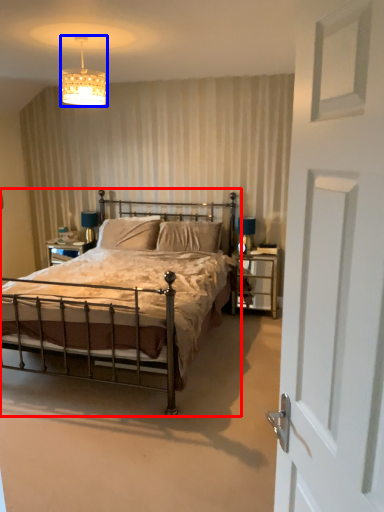
Question: Which point is further to the camera, bed (highlighted by a red box) or lighting (highlighted by a blue box)?

Choices:
 (A) bed
 (B) lighting

Answer: (B)